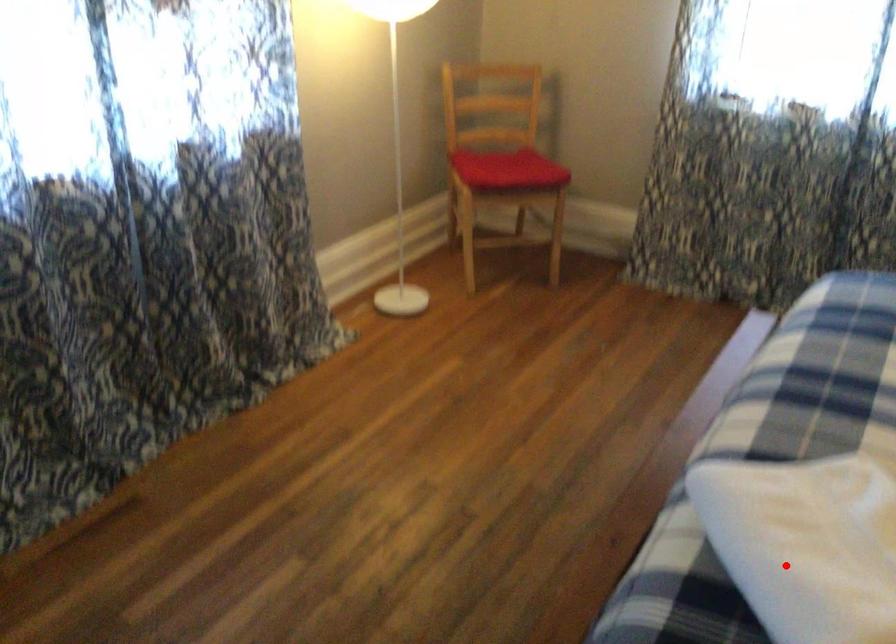
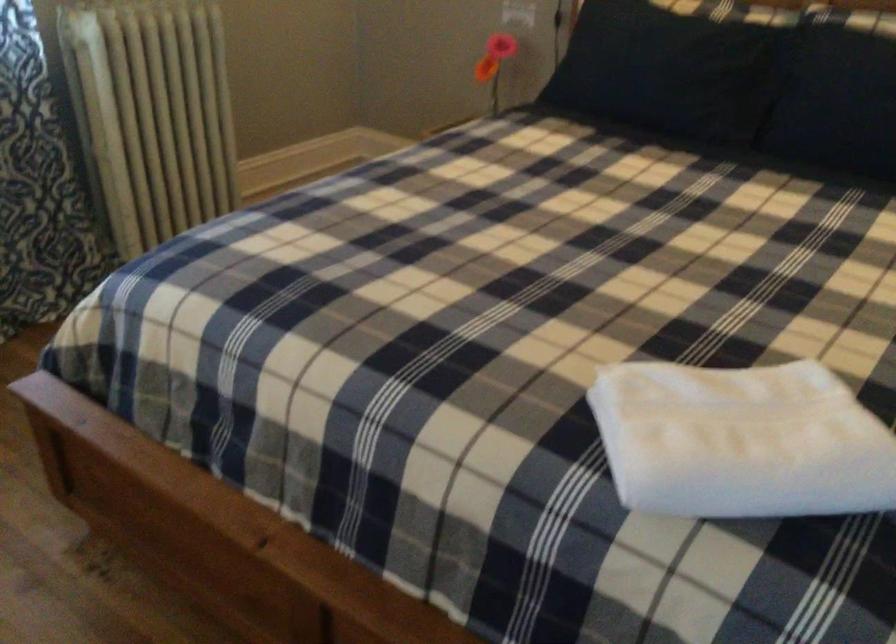
The point at the highlighted location is marked in the first image. Where is the corresponding point in the second image?

(741, 440)